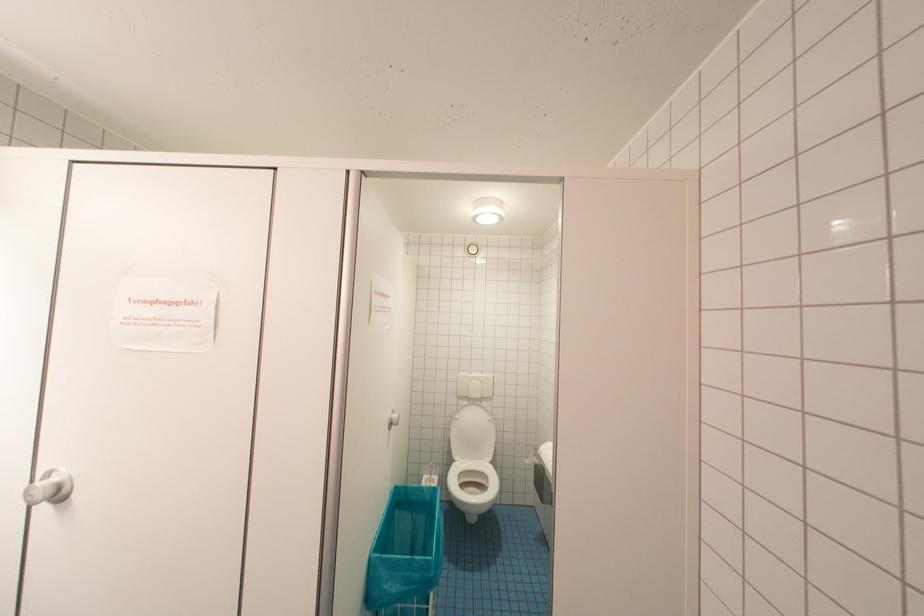
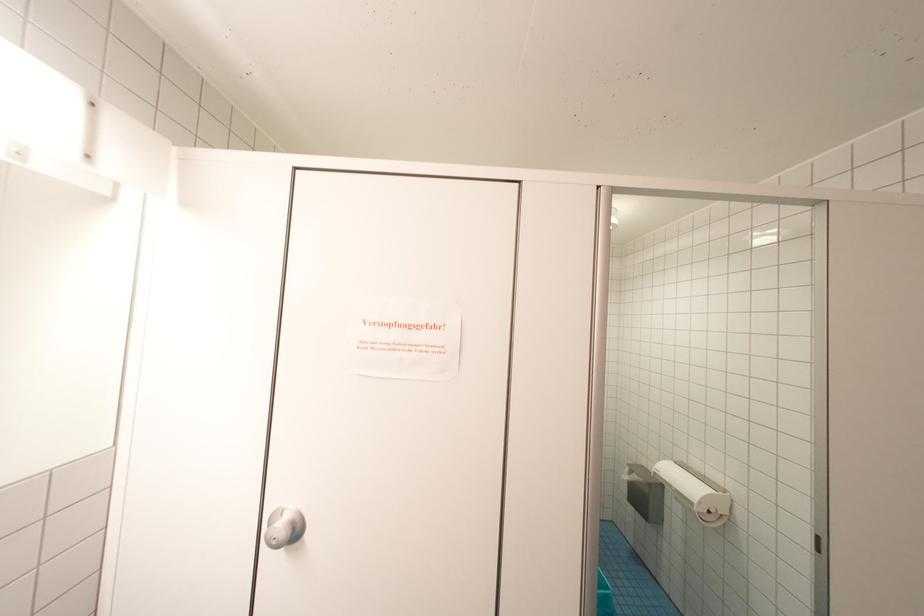
Question: The camera is either moving clockwise (left) or counter-clockwise (right) around the object. The first image is from the beginning of the video and the second image is from the end. Is the camera moving left or right when shooting the video?

Choices:
 (A) Left
 (B) Right

Answer: (A)